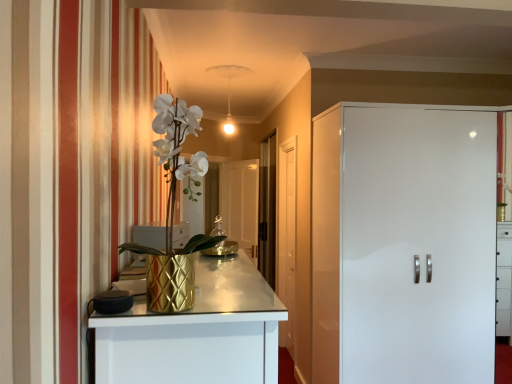
Question: Does gold textured vase at left have a greater height compared to white glossy cabinet at right, positioned as the first door in front-to-back order?

Choices:
 (A) no
 (B) yes

Answer: (A)

Question: Could white glossy cabinet at right, the 1th door from the right, be considered to be inside gold textured vase at left?

Choices:
 (A) yes
 (B) no

Answer: (B)

Question: Is gold textured vase at left outside of white glossy cabinet at right, which appears as the 2th door when viewed from the back?

Choices:
 (A) no
 (B) yes

Answer: (B)

Question: Is gold textured vase at left thinner than white glossy cabinet at right, which appears as the 2th door when viewed from the back?

Choices:
 (A) no
 (B) yes

Answer: (B)

Question: Considering the relative sizes of gold textured vase at left and white glossy cabinet at right, the 2th door positioned from the left, in the image provided, is gold textured vase at left bigger than white glossy cabinet at right, the 2th door positioned from the left,?

Choices:
 (A) yes
 (B) no

Answer: (B)

Question: Considering the relative positions of transparent glass door at center, the 1th glass door positioned from the left, and transparent glass door at center, acting as the first glass door starting from the right, in the image provided, is transparent glass door at center, the 1th glass door positioned from the left, to the left or to the right of transparent glass door at center, acting as the first glass door starting from the right,?

Choices:
 (A) left
 (B) right

Answer: (A)

Question: Is transparent glass door at center, the 1th glass door positioned from the left, in front of or behind transparent glass door at center, which is counted as the second glass door, starting from the left, in the image?

Choices:
 (A) behind
 (B) front

Answer: (A)

Question: In terms of size, does transparent glass door at center, the second glass door in the right-to-left sequence, appear bigger or smaller than transparent glass door at center, which is counted as the second glass door, starting from the left?

Choices:
 (A) big
 (B) small

Answer: (B)

Question: From a real-world perspective, is transparent glass door at center, the 1th glass door positioned from the left, above or below transparent glass door at center, acting as the first glass door starting from the right?

Choices:
 (A) above
 (B) below

Answer: (B)

Question: Is transparent glass door at center, acting as the first glass door starting from the right, inside the boundaries of gold textured vase at left, or outside?

Choices:
 (A) inside
 (B) outside

Answer: (B)

Question: Considering the positions of transparent glass door at center, acting as the first glass door starting from the right, and gold textured vase at left in the image, is transparent glass door at center, acting as the first glass door starting from the right, taller or shorter than gold textured vase at left?

Choices:
 (A) short
 (B) tall

Answer: (B)

Question: From a real-world perspective, is transparent glass door at center, acting as the first glass door starting from the right, above or below gold textured vase at left?

Choices:
 (A) above
 (B) below

Answer: (B)

Question: Would you say transparent glass door at center, which is counted as the second glass door, starting from the left, is to the left or to the right of gold textured vase at left in the picture?

Choices:
 (A) right
 (B) left

Answer: (A)

Question: Looking at the image, does white wooden door at center, which appears as the first door when viewed from the back, seem bigger or smaller compared to white glossy cabinet at right, positioned as the first door in front-to-back order?

Choices:
 (A) big
 (B) small

Answer: (B)

Question: Do you think white wooden door at center, which appears as the first door when viewed from the back, is within white glossy cabinet at right, the 1th door from the right, or outside of it?

Choices:
 (A) inside
 (B) outside

Answer: (B)